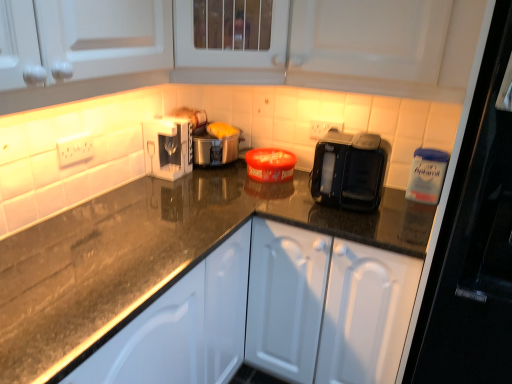
Question: From a real-world perspective, is white matte cabinet at center located beneath matte plastic toaster at center?

Choices:
 (A) yes
 (B) no

Answer: (A)

Question: From a real-world perspective, does white matte cabinet at center stand above matte plastic toaster at center?

Choices:
 (A) no
 (B) yes

Answer: (A)

Question: From the image's perspective, is white matte cabinet at center on matte plastic toaster at center?

Choices:
 (A) yes
 (B) no

Answer: (B)

Question: Is white matte cabinet at center far away from matte plastic toaster at center?

Choices:
 (A) no
 (B) yes

Answer: (A)

Question: Can you confirm if white matte cabinet at center is wider than matte plastic toaster at center?

Choices:
 (A) no
 (B) yes

Answer: (B)

Question: Looking at the image, does white matte cabinet at center seem bigger or smaller compared to white glossy coffee machine at upper center?

Choices:
 (A) small
 (B) big

Answer: (B)

Question: Is point (419, 266) closer or farther from the camera than point (186, 147)?

Choices:
 (A) farther
 (B) closer

Answer: (B)

Question: Considering the positions of white matte cabinet at center and white glossy coffee machine at upper center in the image, is white matte cabinet at center taller or shorter than white glossy coffee machine at upper center?

Choices:
 (A) short
 (B) tall

Answer: (B)

Question: From a real-world perspective, relative to white glossy coffee machine at upper center, is white matte cabinet at center vertically above or below?

Choices:
 (A) below
 (B) above

Answer: (A)

Question: Considering the relative positions of white glossy coffee machine at upper center and matte plastic toaster at center in the image provided, is white glossy coffee machine at upper center to the left or to the right of matte plastic toaster at center?

Choices:
 (A) left
 (B) right

Answer: (A)

Question: Considering the positions of white glossy coffee machine at upper center and matte plastic toaster at center in the image, is white glossy coffee machine at upper center bigger or smaller than matte plastic toaster at center?

Choices:
 (A) small
 (B) big

Answer: (A)

Question: Considering the positions of white glossy coffee machine at upper center and matte plastic toaster at center in the image, is white glossy coffee machine at upper center taller or shorter than matte plastic toaster at center?

Choices:
 (A) tall
 (B) short

Answer: (B)

Question: From the image's perspective, is white glossy coffee machine at upper center located above or below matte plastic toaster at center?

Choices:
 (A) above
 (B) below

Answer: (B)

Question: Is white glossy coffee machine at upper center bigger or smaller than white matte cabinet at center?

Choices:
 (A) big
 (B) small

Answer: (B)

Question: From their relative heights in the image, would you say white glossy coffee machine at upper center is taller or shorter than white matte cabinet at center?

Choices:
 (A) short
 (B) tall

Answer: (A)